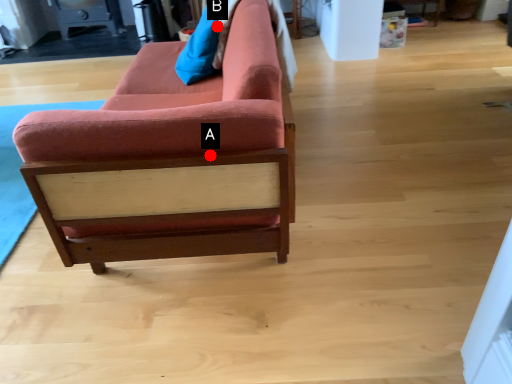
Question: Two points are circled on the image, labeled by A and B beside each circle. Which point is farther from the camera taking this photo?

Choices:
 (A) A is further
 (B) B is further

Answer: (B)